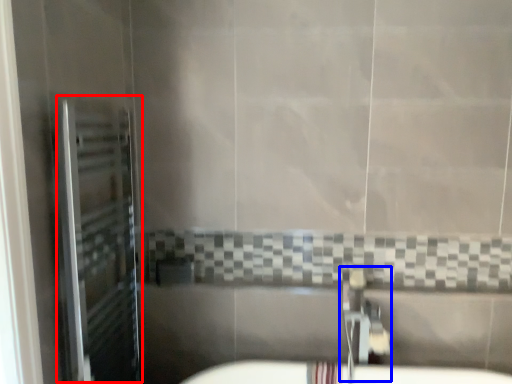
Question: Which object appears closest to the camera in this image, screen door (highlighted by a red box) or plumbing fixture (highlighted by a blue box)?

Choices:
 (A) screen door
 (B) plumbing fixture

Answer: (A)